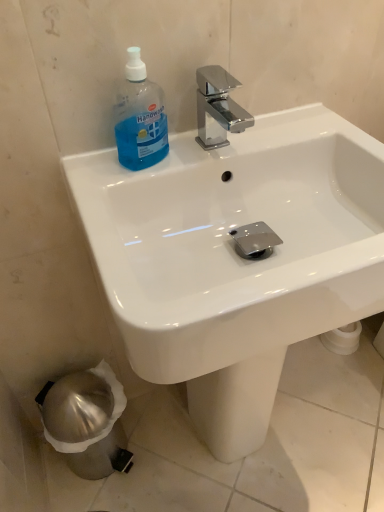
Question: Which is correct: blue translucent plastic handwash at upper left is inside white glossy sink at center, or outside of it?

Choices:
 (A) inside
 (B) outside

Answer: (A)

Question: From a real-world perspective, relative to white glossy sink at center, is blue translucent plastic handwash at upper left vertically above or below?

Choices:
 (A) below
 (B) above

Answer: (B)

Question: Is blue translucent plastic handwash at upper left taller or shorter than white glossy sink at center?

Choices:
 (A) tall
 (B) short

Answer: (B)

Question: In terms of size, does white glossy sink at center appear bigger or smaller than blue translucent plastic handwash at upper left?

Choices:
 (A) small
 (B) big

Answer: (B)

Question: In terms of height, does white glossy sink at center look taller or shorter compared to blue translucent plastic handwash at upper left?

Choices:
 (A) short
 (B) tall

Answer: (B)

Question: Is point (337, 138) closer or farther from the camera than point (150, 121)?

Choices:
 (A) farther
 (B) closer

Answer: (A)

Question: Considering the relative positions of white glossy sink at center and blue translucent plastic handwash at upper left in the image provided, is white glossy sink at center to the left or to the right of blue translucent plastic handwash at upper left?

Choices:
 (A) right
 (B) left

Answer: (A)